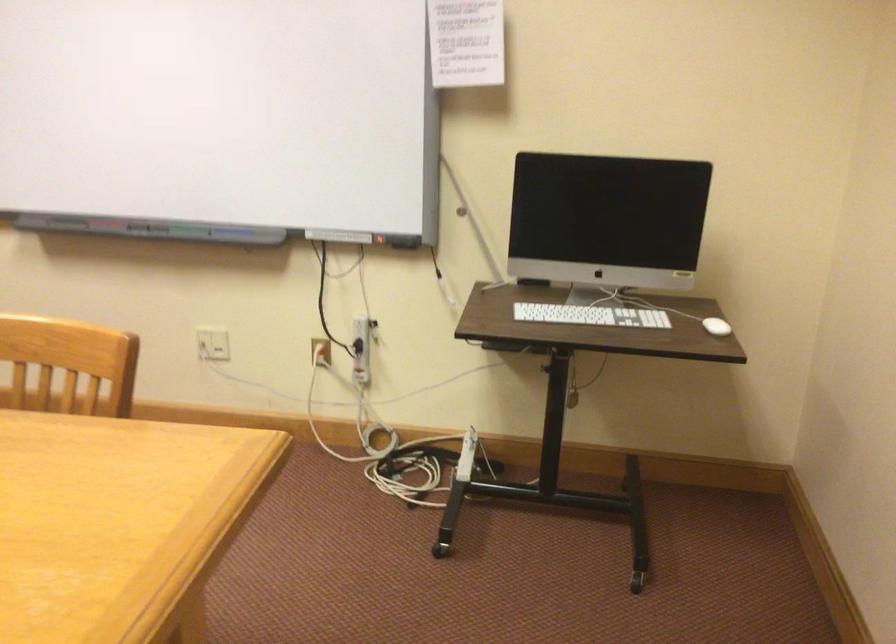
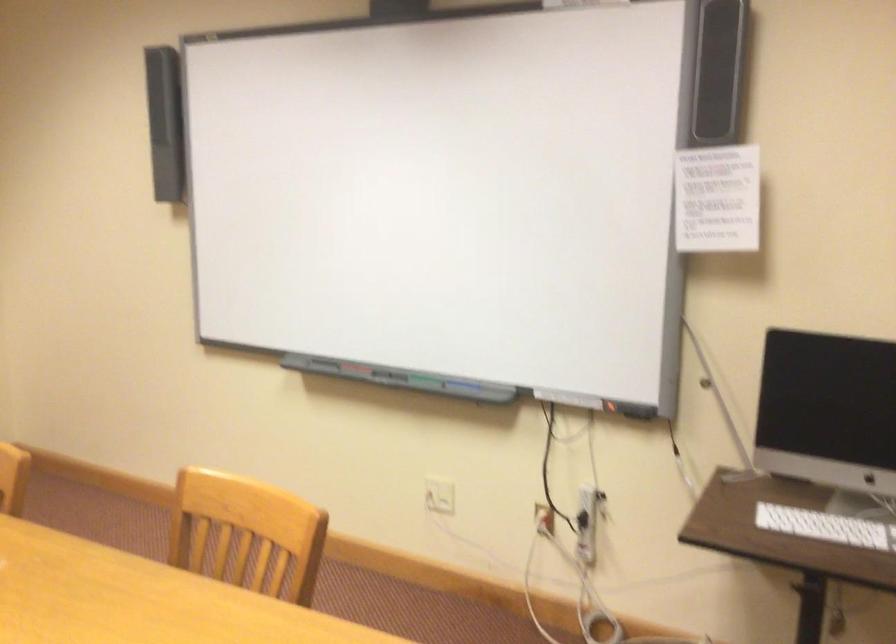
What movement of the cameraman would produce the second image?

The movement direction of the cameraman is right, forward.